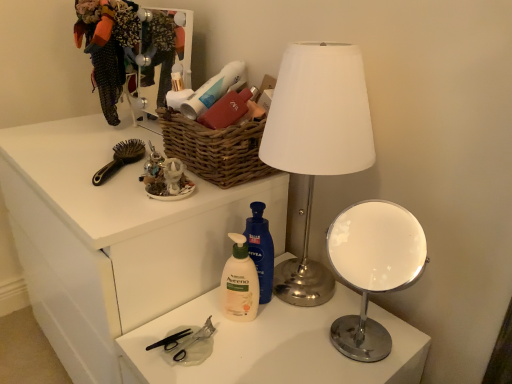
Locate an element on the screen. The height and width of the screenshot is (384, 512). vacant area in front of patterned fabric dress at upper left is located at coordinates (98, 135).